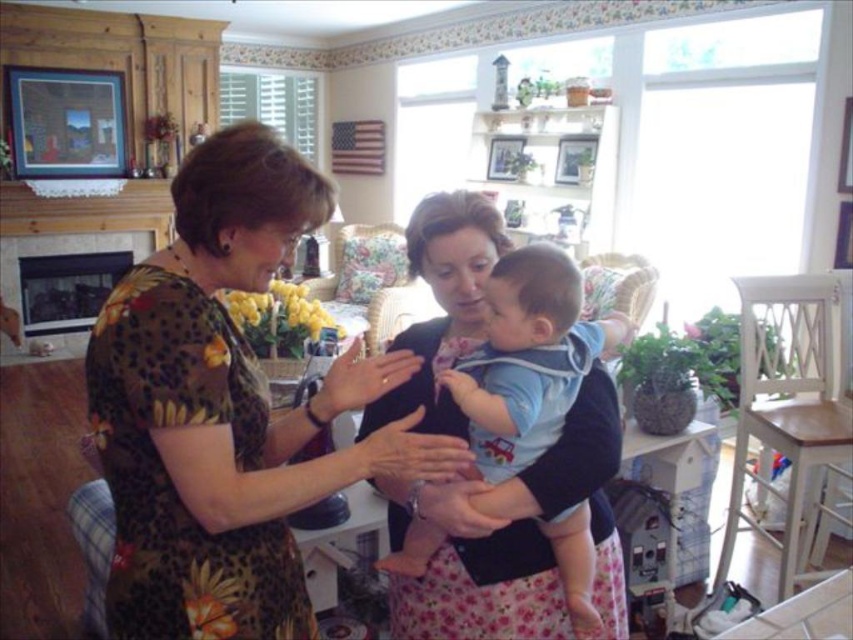
You are a tailor measuring clothes for two people in the image. The floral dress at center and the light blue cotton shirt at center are both in need of alterations. Which garment requires more fabric to widen the width? Please explain your reasoning based on the garments shown.

The floral dress at center requires more fabric to widen its width because its current width is greater than the light blue cotton shirt at center. Since the dress is already wider, expanding it further would necessitate more additional fabric compared to the shirt.

You are standing in the living room and want to hand a gift to the person wearing the floral dress at center. Which direction should you move to reach them first, considering their position relative to the light blue cotton shirt at center?

The floral dress at center is in front of the light blue cotton shirt at center, so you should move towards the floral dress at center first as it is closer to you.

Consider the image. You are standing in the room and want to reach both points. Which point, point (152, 317) or point (514, 316), will you reach first?

Point (152, 317) is closer to the viewer than point (514, 316), so you will reach point (152, 317) first.